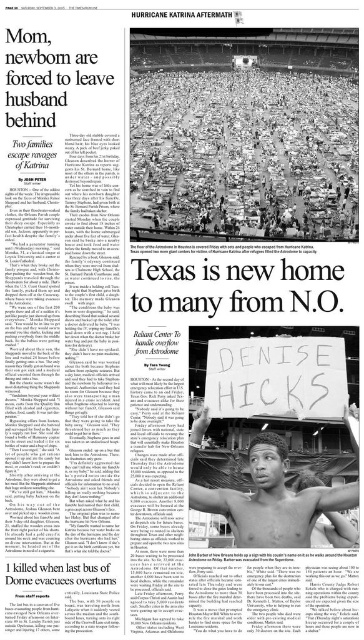
Does shiny metallic sign at center appear on the right side of shiny black skin at center?

Yes, shiny metallic sign at center is to the right of shiny black skin at center.

Between shiny metallic sign at center and shiny black skin at center, which one has more height?

With more height is shiny metallic sign at center.

Is point (188, 180) more distant than point (287, 499)?

That is True.

At what (x,y) coordinates should I click in order to perform the action: click on shiny metallic sign at center. Please return your answer as a coordinate pair (x, y). Looking at the image, I should click on (244, 154).

Is point (164, 83) farther from viewer compared to point (311, 348)?

Yes, point (164, 83) is behind point (311, 348).

Consider the image. Does shiny metallic sign at center have a greater width compared to white paper sign at center?

Correct, the width of shiny metallic sign at center exceeds that of white paper sign at center.

At what (x,y) coordinates should I click in order to perform the action: click on shiny metallic sign at center. Please return your answer as a coordinate pair (x, y). Looking at the image, I should click on (244, 154).

I want to click on shiny metallic sign at center, so click(244, 154).

Is white paper sign at center below shiny black skin at center?

Incorrect, white paper sign at center is not positioned below shiny black skin at center.

Is white paper sign at center behind shiny black skin at center?

Yes.

Does point (271, 404) come in front of point (198, 442)?

No, (271, 404) is behind (198, 442).

I want to click on white paper sign at center, so click(277, 378).